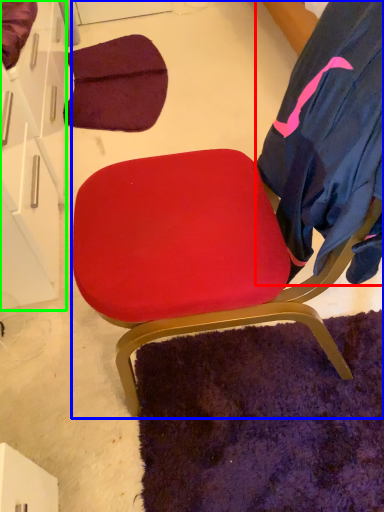
Question: Considering the real-world distances, which object is farthest from robe (highlighted by a red box)? chair (highlighted by a blue box) or drawer (highlighted by a green box)?

Choices:
 (A) chair
 (B) drawer

Answer: (B)